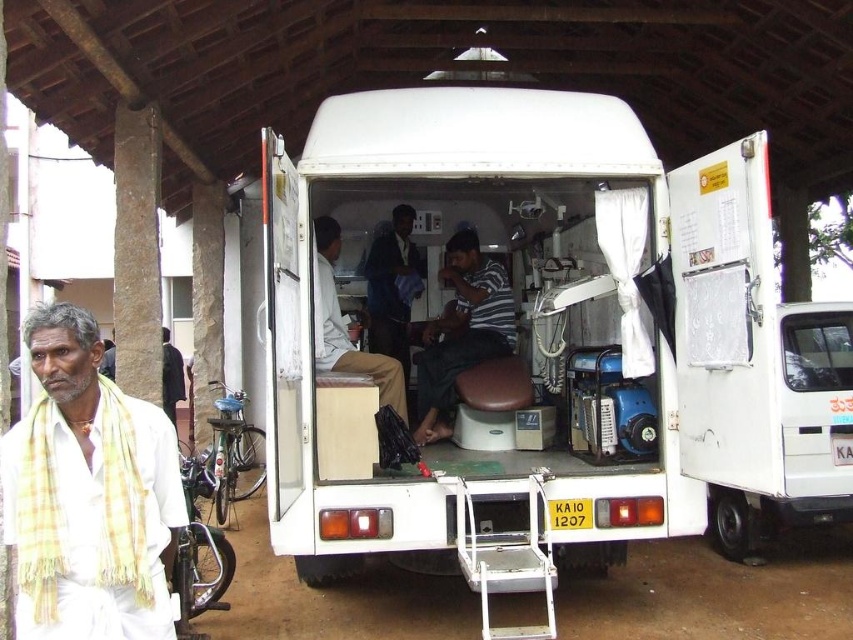
Question: Considering the relative positions of white plastic van at center and white cotton shirt at center in the image provided, where is white plastic van at center located with respect to white cotton shirt at center?

Choices:
 (A) above
 (B) below

Answer: (A)

Question: Which of the following is the closest to the observer?

Choices:
 (A) click(169, 481)
 (B) click(314, 298)
 (C) click(386, 269)

Answer: (A)

Question: Which point is closer to the camera?

Choices:
 (A) white plastic van at center
 (B) dark blue shirt at center
 (C) white cotton shirt at center

Answer: (A)

Question: Which object appears closest to the camera in this image?

Choices:
 (A) white cotton shirt at center
 (B) striped cotton shirt at center

Answer: (A)

Question: Is yellow checkered scarf at left closer to the viewer compared to white cotton shirt at center?

Choices:
 (A) yes
 (B) no

Answer: (A)

Question: Is the position of white plastic van at center less distant than that of striped cotton shirt at center?

Choices:
 (A) no
 (B) yes

Answer: (B)